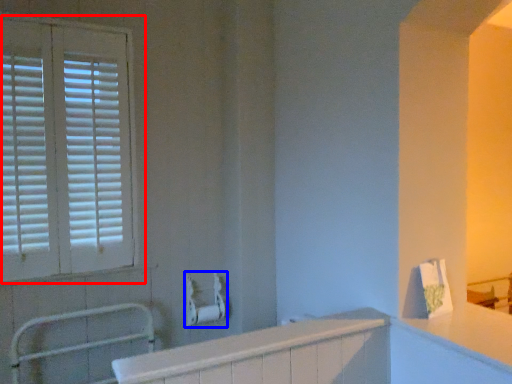
Question: Among these objects, which one is nearest to the camera, window (highlighted by a red box) or towel bar (highlighted by a blue box)?

Choices:
 (A) window
 (B) towel bar

Answer: (A)